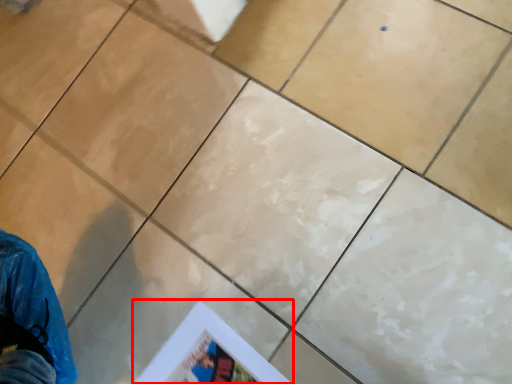
Question: From the image's perspective, what is the correct spatial positioning of poster page (annotated by the red box) in reference to ceramic tile?

Choices:
 (A) below
 (B) above

Answer: (A)